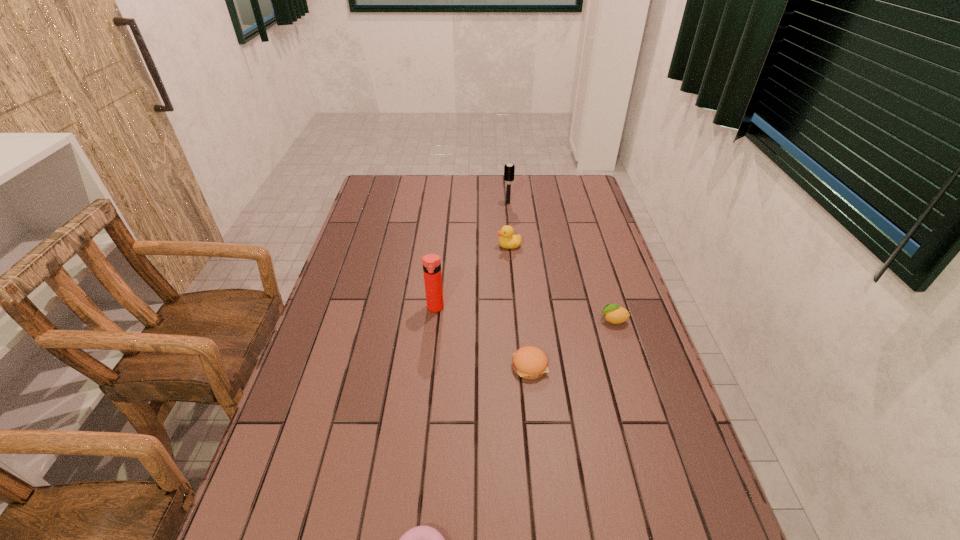
Where is `vacant area situated on the face of the duckling`? vacant area situated on the face of the duckling is located at coordinates (431, 245).

Identify the location of free spot located on the face of the duckling. Image resolution: width=960 pixels, height=540 pixels. (414, 245).

Image resolution: width=960 pixels, height=540 pixels. In order to click on free spot located on the face of the duckling in this screenshot , I will do `click(477, 245)`.

Locate an element on the screen. The width and height of the screenshot is (960, 540). vacant region located 0.140m with leaves positioned above the third shortest object is located at coordinates (549, 320).

Locate an element on the screen. This screenshot has height=540, width=960. free location located with leaves positioned above the third shortest object is located at coordinates (522, 320).

The image size is (960, 540). What are the coordinates of `vacant area situated 0.120m with leaves positioned above the third shortest object` in the screenshot? It's located at (557, 320).

Where is `free space located 0.200m on the back of the patty`? free space located 0.200m on the back of the patty is located at coordinates (523, 300).

Image resolution: width=960 pixels, height=540 pixels. I want to click on object situated at the far edge, so click(x=509, y=169).

I want to click on object that is positioned at the right edge, so click(x=614, y=314).

Image resolution: width=960 pixels, height=540 pixels. In order to click on vacant region at the far edge of the desktop in this screenshot , I will do `click(467, 203)`.